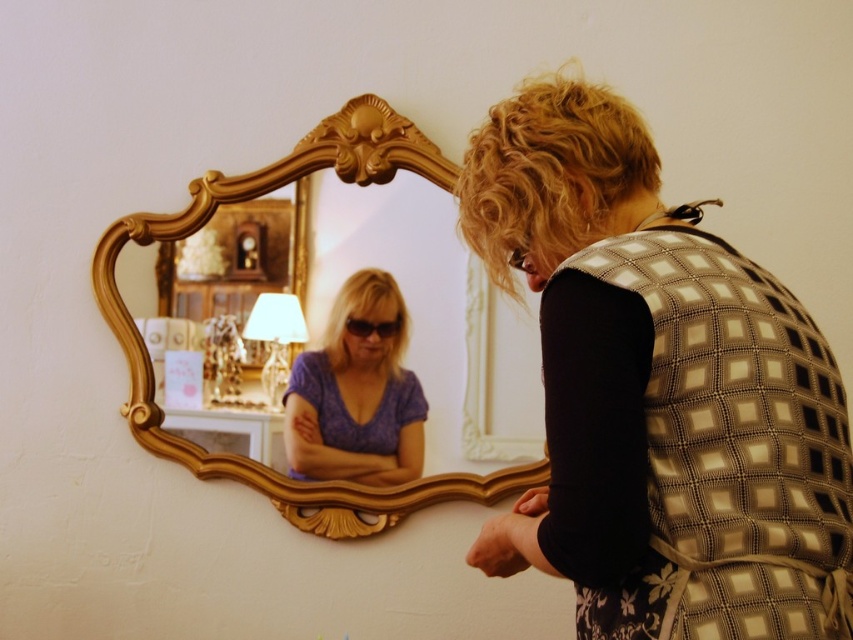
Consider the image. Is gold ornate mirror at upper center wider than purple matte shirt at center?

Correct, the width of gold ornate mirror at upper center exceeds that of purple matte shirt at center.

Between point (392, 524) and point (350, 337), which one is positioned in front?

Point (392, 524) is in front.

This screenshot has width=853, height=640. Find the location of `gold ornate mirror at upper center`. gold ornate mirror at upper center is located at coordinates (250, 198).

Is patterned fabric vest at center wider than gold ornate mirror at upper center?

No, patterned fabric vest at center is not wider than gold ornate mirror at upper center.

Is patterned fabric vest at center behind gold ornate mirror at upper center?

No.

Is point (761, 316) closer to viewer compared to point (415, 497)?

Yes, point (761, 316) is closer to viewer.

The height and width of the screenshot is (640, 853). I want to click on patterned fabric vest at center, so click(x=659, y=392).

Locate an element on the screen. patterned fabric vest at center is located at coordinates (659, 392).

Between patterned fabric vest at center and purple matte shirt at center, which one appears on the left side from the viewer's perspective?

From the viewer's perspective, purple matte shirt at center appears more on the left side.

Is point (646, 545) in front of point (294, 429)?

Yes, point (646, 545) is in front of point (294, 429).

This screenshot has width=853, height=640. In order to click on patterned fabric vest at center in this screenshot , I will do `click(659, 392)`.